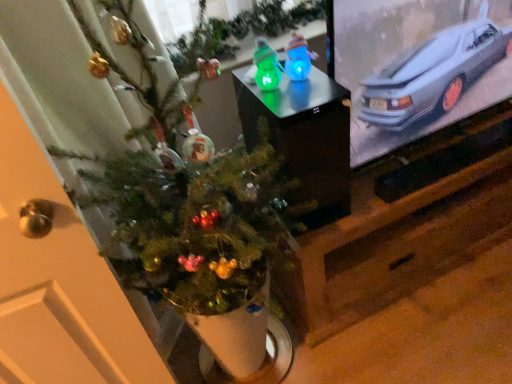
Find the location of a particular element. The height and width of the screenshot is (384, 512). vacant space to the right of green matte christmas tree at center is located at coordinates (381, 342).